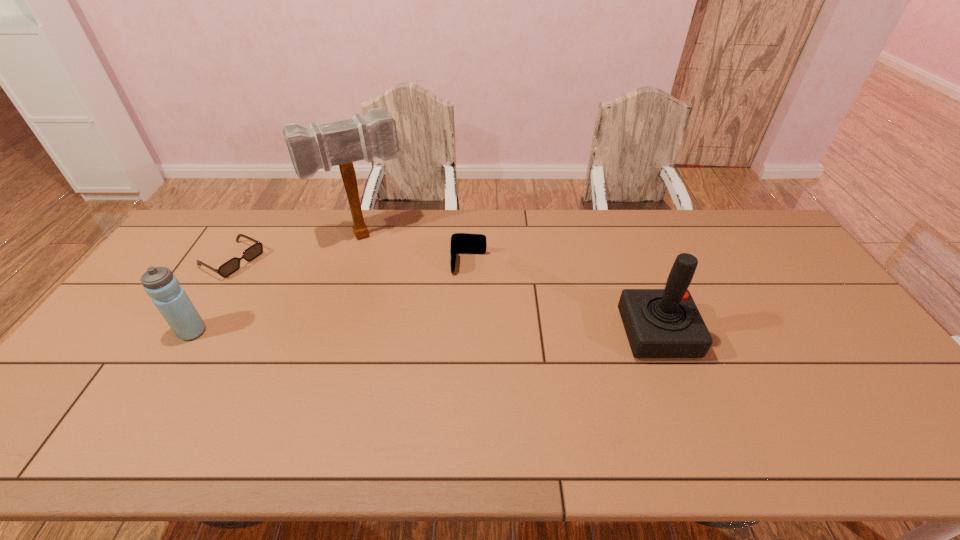
At what (x,y) coordinates should I click in order to perform the action: click on vacant point that satisfies the following two spatial constraints: 1. on the front side of the wallet; 2. on the left side of the third object from left to right. Please return your answer as a coordinate pair (x, y). Looking at the image, I should click on 355,264.

Find the location of a particular element. Image resolution: width=960 pixels, height=540 pixels. blank space that satisfies the following two spatial constraints: 1. on the front side of the second shortest object; 2. on the right side of the tallest object is located at coordinates click(355, 264).